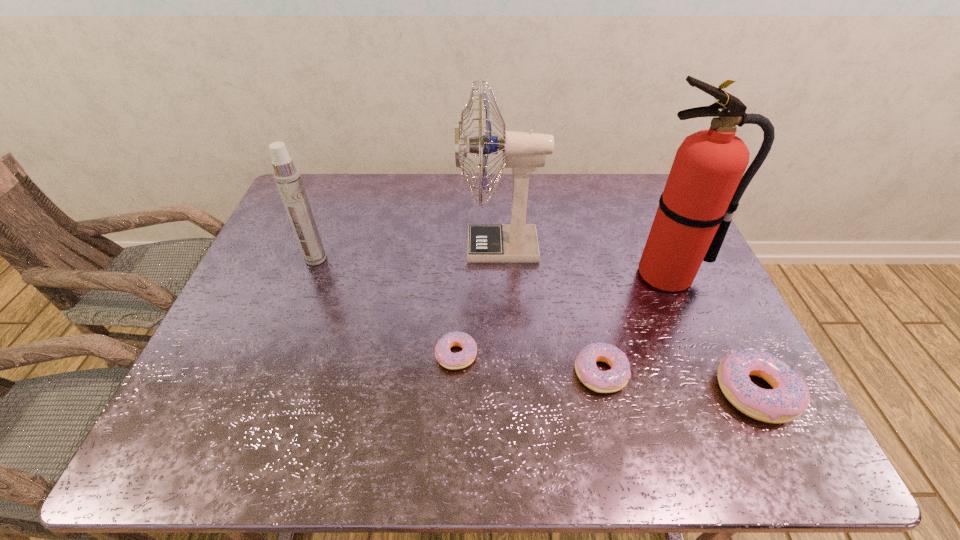
What are the coordinates of `the leftmost doughnut` in the screenshot? It's located at (453, 361).

I want to click on the shortest doughnut, so click(453, 361).

Identify the location of the second tallest doughnut. (616, 378).

The image size is (960, 540). I want to click on the second shortest object, so click(x=616, y=378).

Locate an element on the screen. The image size is (960, 540). the rightmost doughnut is located at coordinates (789, 398).

This screenshot has width=960, height=540. I want to click on the third shortest object, so click(789, 398).

The width and height of the screenshot is (960, 540). What are the coordinates of `fire extinguisher` in the screenshot? It's located at (705, 184).

Identify the location of fan. Image resolution: width=960 pixels, height=540 pixels. (522, 151).

Locate an element on the screen. This screenshot has height=540, width=960. the fourth shortest object is located at coordinates (287, 177).

The height and width of the screenshot is (540, 960). I want to click on aerosol can, so click(x=287, y=177).